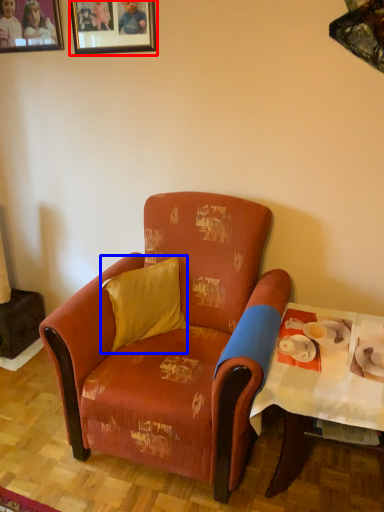
Question: Among these objects, which one is farthest to the camera, picture frame (highlighted by a red box) or pillow (highlighted by a blue box)?

Choices:
 (A) picture frame
 (B) pillow

Answer: (A)